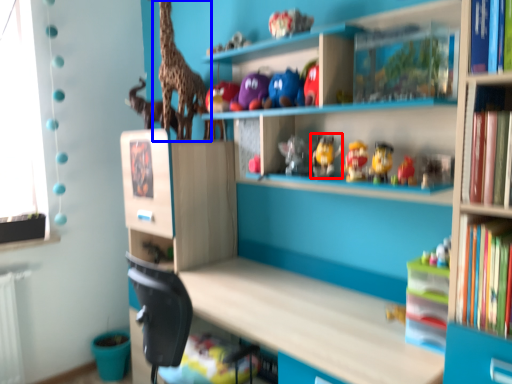
Question: Which of the following is the farthest to the observer, toy (highlighted by a red box) or giraffe (highlighted by a blue box)?

Choices:
 (A) toy
 (B) giraffe

Answer: (B)